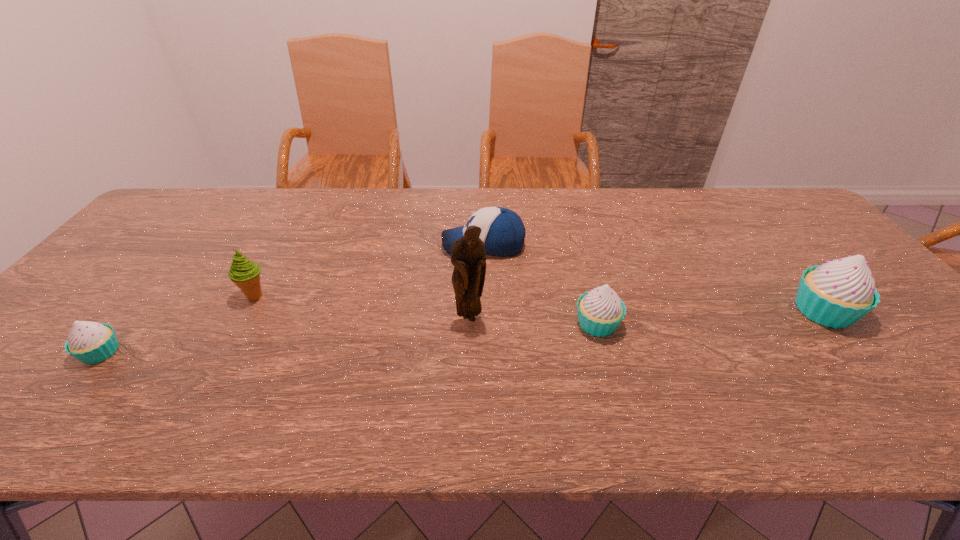
Please point a location where one more cupcake can be added evenly. Please provide its 2D coordinates. Your answer should be formatted as a tuple, i.e. [(x, y)], where the tuple contains the x and y coordinates of a point satisfying the conditions above.

[(357, 338)]